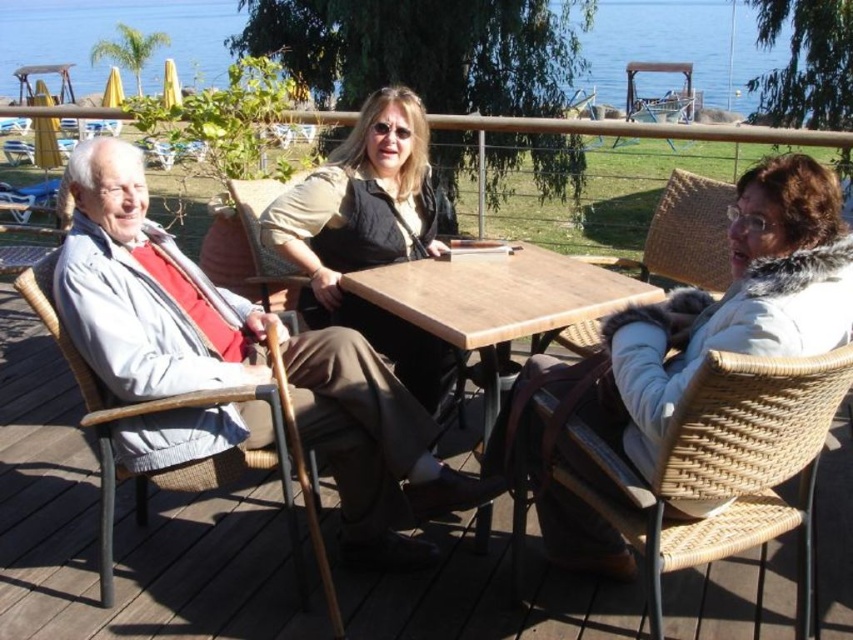
Based on the photo, how distant is transparent water at center from woven rattan chair at center?

The distance of transparent water at center from woven rattan chair at center is 17.01 meters.

Between transparent water at center and woven rattan chair at center, which one has less height?

woven rattan chair at center is shorter.

Identify the location of transparent water at center. (112, 33).

Identify the location of transparent water at center. The height and width of the screenshot is (640, 853). (112, 33).

Can you confirm if woven rattan chair at center is wider than woven wicker chair at center?

In fact, woven rattan chair at center might be narrower than woven wicker chair at center.

Which is in front, point (579, 339) or point (274, 280)?

Point (579, 339)

Where is `woven rattan chair at center`? woven rattan chair at center is located at coordinates (683, 234).

Is point (422, 486) farther from camera compared to point (318, 291)?

No, (422, 486) is in front of (318, 291).

Is light gray fabric jacket at left to the left of matte beige vest at center from the viewer's perspective?

Correct, you'll find light gray fabric jacket at left to the left of matte beige vest at center.

Between point (177, 412) and point (430, 198), which one is positioned behind?

Positioned behind is point (430, 198).

Find the location of `light gray fabric jacket at left`. light gray fabric jacket at left is located at coordinates (242, 356).